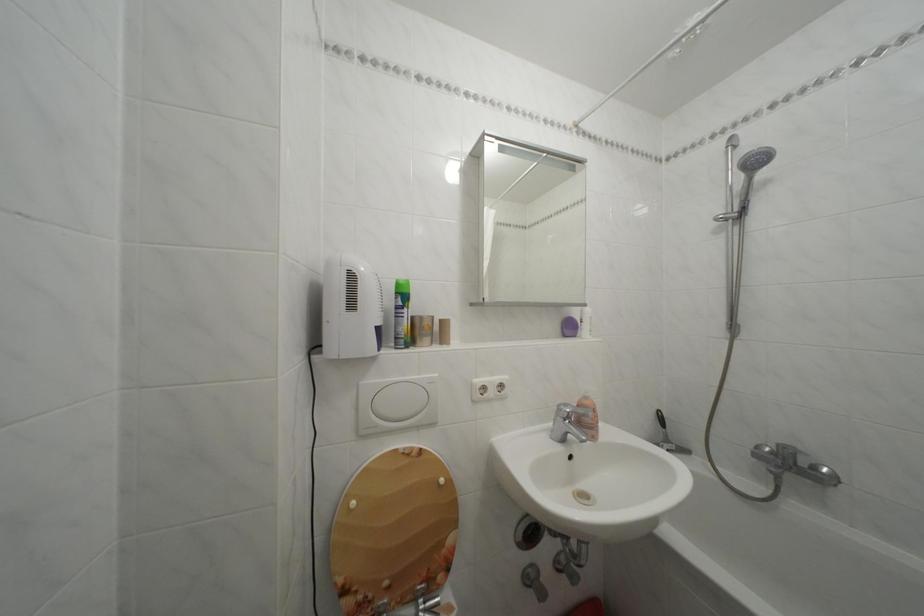
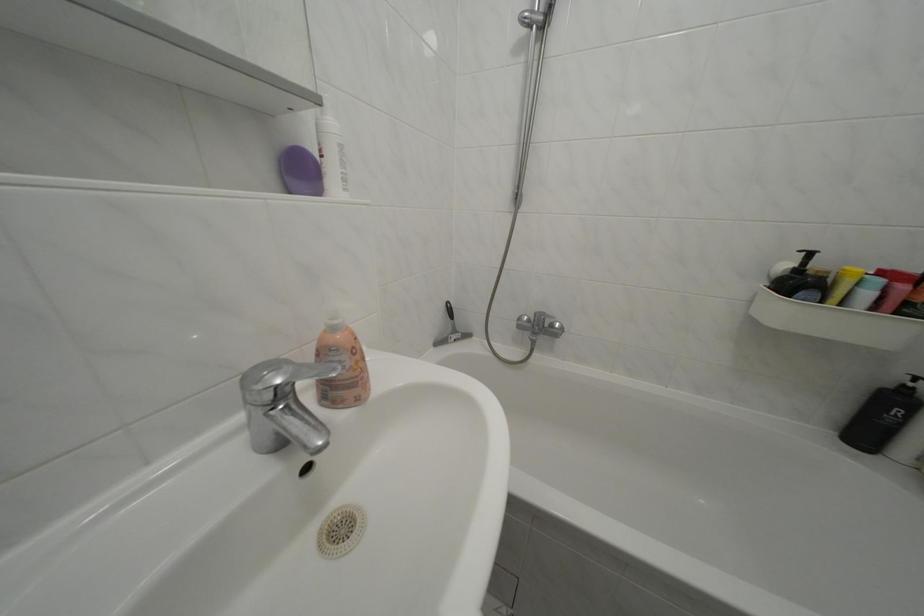
In the second image, find the point that corresponds to the point at 822,475 in the first image.

(562, 331)